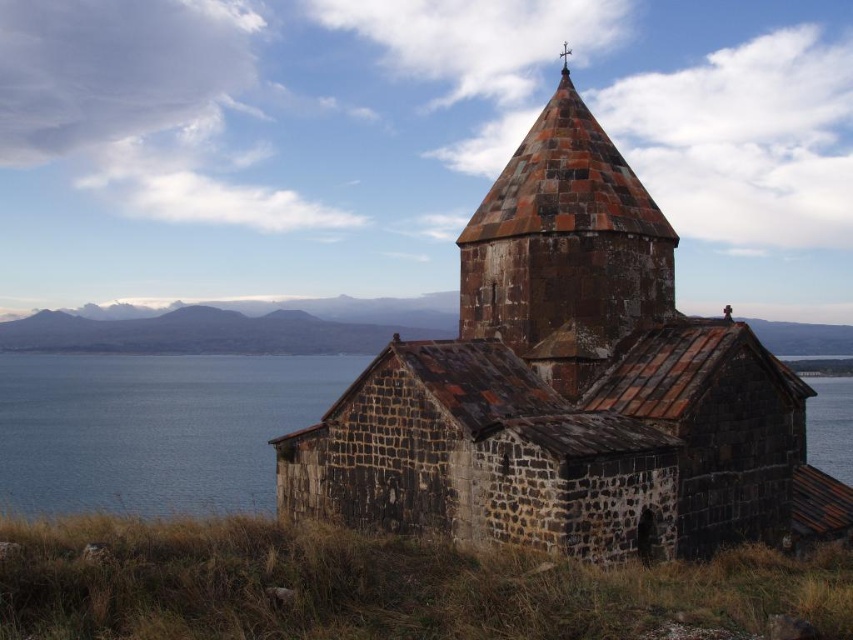
Question: Which point is farther to the camera?

Choices:
 (A) rustic stone tower at center
 (B) blue water at left
 (C) rustic stone church at center

Answer: (B)

Question: Is blue water at lower left below blue water at left?

Choices:
 (A) no
 (B) yes

Answer: (A)

Question: Which of the following is the closest to the observer?

Choices:
 (A) blue water at left
 (B) rustic stone tower at center
 (C) blue water at lower left
 (D) rustic stone church at center

Answer: (D)

Question: Where is rustic stone church at center located in relation to blue water at lower left in the image?

Choices:
 (A) above
 (B) below

Answer: (A)

Question: Does rustic stone church at center appear under blue water at left?

Choices:
 (A) no
 (B) yes

Answer: (A)

Question: Which of the following is the farthest from the observer?

Choices:
 (A) rustic stone tower at center
 (B) rustic stone church at center

Answer: (A)